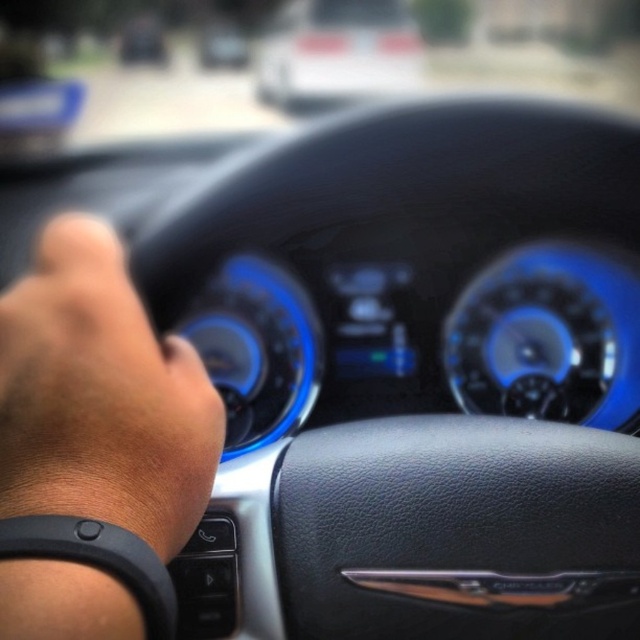
Who is shorter, dark skin wristband at lower left or white glossy car at upper center?

With less height is white glossy car at upper center.

Which is in front, point (36, 508) or point (344, 90)?

Point (36, 508) is in front.

Which is behind, point (61, 396) or point (353, 28)?

Point (353, 28)

You are a GUI agent. You are given a task and a screenshot of the screen. Output one action in this format:
    pyautogui.click(x=<x>, y=<y>)
    Task: Click on the dark skin wristband at lower left
    The image size is (640, 640).
    Given the screenshot: What is the action you would take?
    pyautogui.click(x=100, y=396)

Does white glossy car at upper center have a lesser height compared to matte black steering wheel at center?

In fact, white glossy car at upper center may be taller than matte black steering wheel at center.

Who is higher up, white glossy car at upper center or matte black steering wheel at center?

matte black steering wheel at center is above.

Who is more distant from viewer, (266, 42) or (216, 20)?

Positioned behind is point (216, 20).

At what (x,y) coordinates should I click in order to perform the action: click on white glossy car at upper center. Please return your answer as a coordinate pair (x, y). The width and height of the screenshot is (640, 640). Looking at the image, I should click on (339, 52).

Is dark skin wristband at lower left shorter than matte black steering wheel at center?

No.

Can you confirm if dark skin wristband at lower left is wider than matte black steering wheel at center?

Indeed, dark skin wristband at lower left has a greater width compared to matte black steering wheel at center.

Is point (48, 440) positioned behind point (220, 49)?

No, (48, 440) is in front of (220, 49).

You are a GUI agent. You are given a task and a screenshot of the screen. Output one action in this format:
    pyautogui.click(x=<x>, y=<y>)
    Task: Click on the dark skin wristband at lower left
    
    Given the screenshot: What is the action you would take?
    pyautogui.click(x=100, y=396)